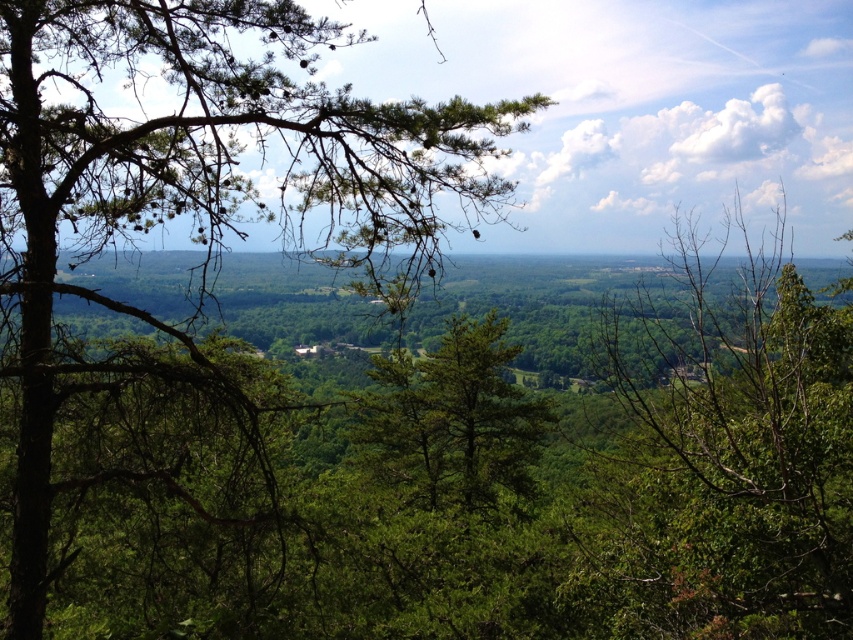
Looking at this image, you are an ornithologist observing birds in the forest. You notice two trees in the scene. Which tree is closer to the horizon, the green matte tree at upper left or the green leafy tree at center?

The green leafy tree at center is closer to the horizon than the green matte tree at upper left because the green matte tree at upper left is smaller than the green leafy tree at center, implying it is farther away.

Based on the coordinates provided, can you identify which object is located at point (195, 177)?

The green matte tree at upper left is located at point (195, 177).